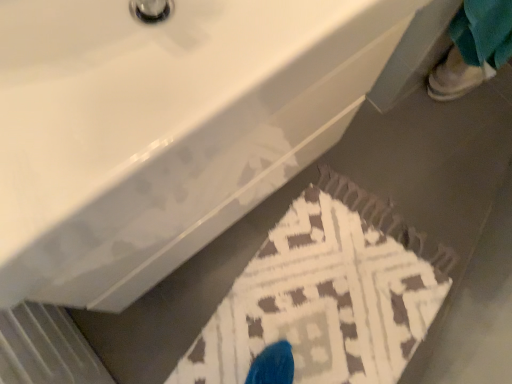
Locate an element on the screen. vacant space in front of white leather shoe at upper right is located at coordinates (449, 132).